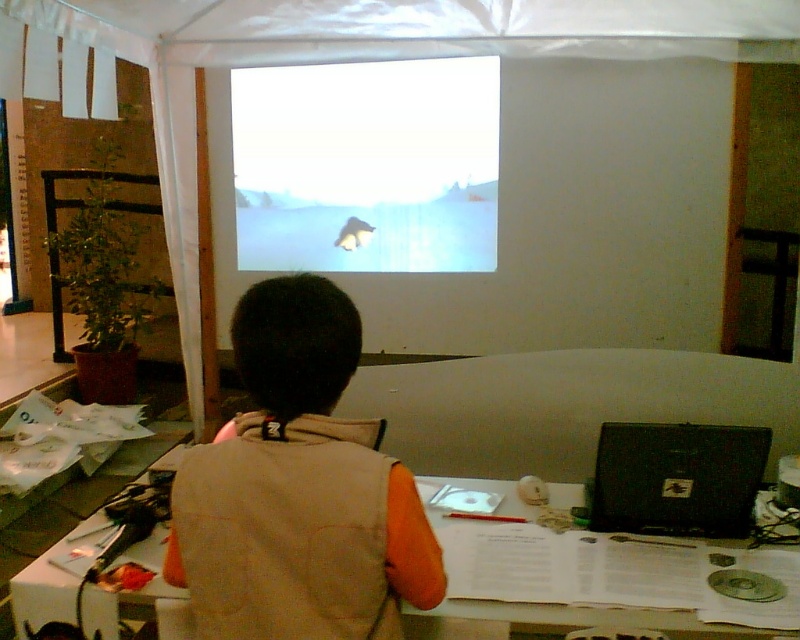
Does orange fabric vest at center appear on the right side of white paper at center?

In fact, orange fabric vest at center is to the left of white paper at center.

The width and height of the screenshot is (800, 640). Find the location of `orange fabric vest at center`. orange fabric vest at center is located at coordinates (300, 488).

Does point (290, 486) lie behind point (524, 618)?

No, it is in front of (524, 618).

This screenshot has height=640, width=800. I want to click on orange fabric vest at center, so click(x=300, y=488).

From the picture: Does white glossy screen at center come behind black matte laptop at right?

Yes, it is.

Does white glossy screen at center appear on the right side of black matte laptop at right?

In fact, white glossy screen at center is to the left of black matte laptop at right.

The width and height of the screenshot is (800, 640). I want to click on white glossy screen at center, so click(x=368, y=164).

This screenshot has width=800, height=640. Find the location of `white glossy screen at center`. white glossy screen at center is located at coordinates (368, 164).

Does orange fabric vest at center have a larger size compared to white glossy screen at center?

No, orange fabric vest at center is not bigger than white glossy screen at center.

Between point (388, 525) and point (256, 132), which one is positioned in front?

Point (388, 525)

The width and height of the screenshot is (800, 640). Find the location of `orange fabric vest at center`. orange fabric vest at center is located at coordinates (300, 488).